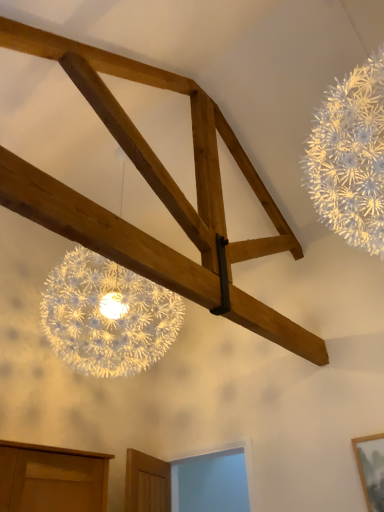
Describe the element at coordinates (107, 316) in the screenshot. I see `white textured lamp at lower left` at that location.

The image size is (384, 512). Find the location of `white textured lamp at lower left`. white textured lamp at lower left is located at coordinates (107, 316).

The width and height of the screenshot is (384, 512). Identify the location of white textured lamp at lower left. (107, 316).